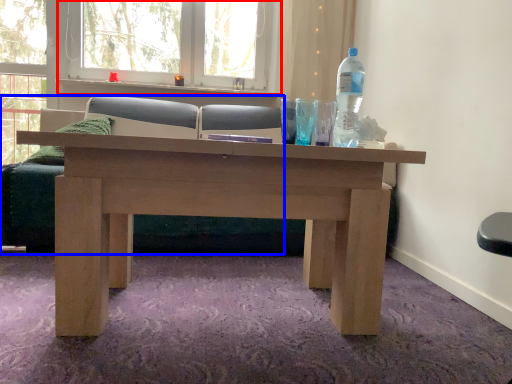
Question: Which object appears closest to the camera in this image, window frame (highlighted by a red box) or studio couch (highlighted by a blue box)?

Choices:
 (A) window frame
 (B) studio couch

Answer: (B)